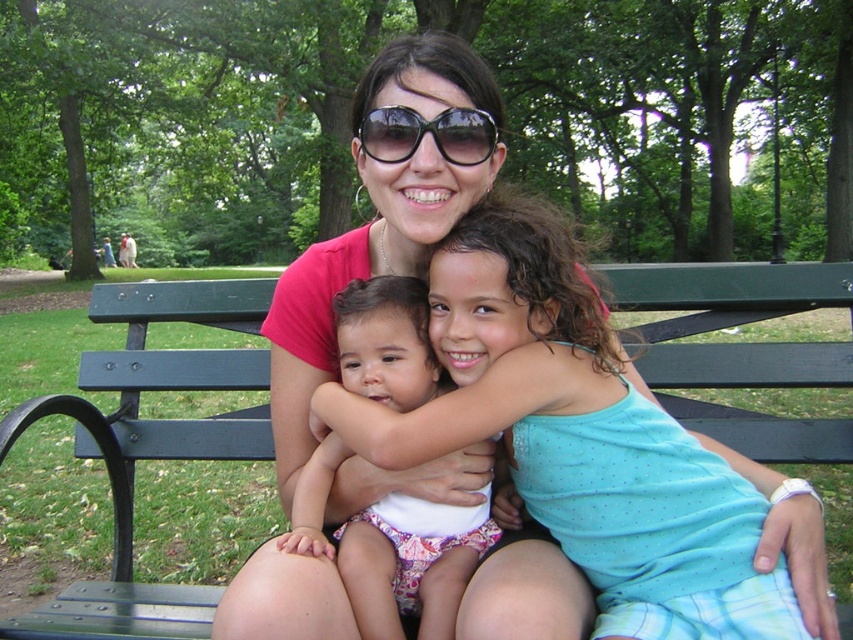
Consider the image. Between white fabric diaper at center and black plastic sunglasses at center, which one appears on the left side from the viewer's perspective?

From the viewer's perspective, white fabric diaper at center appears more on the left side.

Does white fabric diaper at center appear over black plastic sunglasses at center?

Actually, white fabric diaper at center is below black plastic sunglasses at center.

You are a GUI agent. You are given a task and a screenshot of the screen. Output one action in this format:
    pyautogui.click(x=<x>, y=<y>)
    Task: Click on the white fabric diaper at center
    Image resolution: width=853 pixels, height=640 pixels.
    Given the screenshot: What is the action you would take?
    tap(392, 550)

Is point (712, 429) more distant than point (397, 637)?

Yes.

Is green wood bench at center to the left of white fabric diaper at center from the viewer's perspective?

Yes, green wood bench at center is to the left of white fabric diaper at center.

Does point (676, 376) come behind point (370, 365)?

That is True.

I want to click on green wood bench at center, so click(x=160, y=440).

Is green wood bench at center smaller than black plastic sunglasses at center?

Incorrect, green wood bench at center is not smaller in size than black plastic sunglasses at center.

Who is more forward, (792, 364) or (477, 163)?

Point (477, 163)

I want to click on green wood bench at center, so [x=160, y=440].

Locate an element on the screen. This screenshot has height=640, width=853. green wood bench at center is located at coordinates (160, 440).